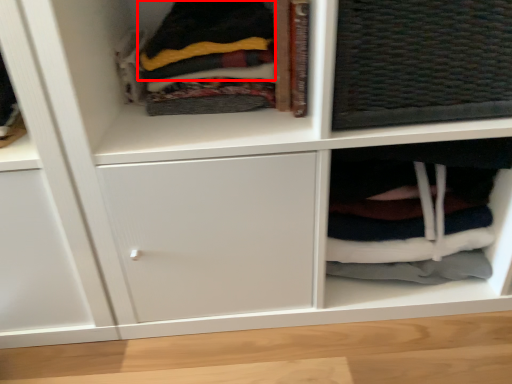
Question: From the image's perspective, considering the relative positions of clothing (annotated by the red box) and cabinet in the image provided, where is clothing (annotated by the red box) located with respect to the staircase?

Choices:
 (A) below
 (B) above

Answer: (B)